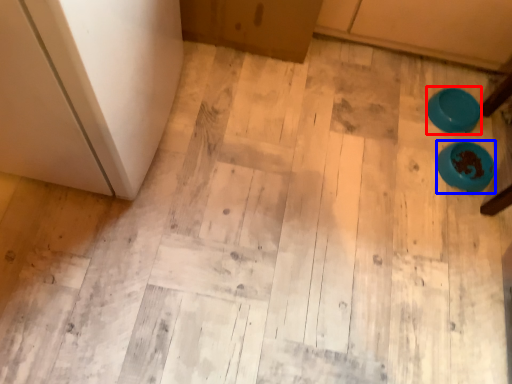
Question: Which object appears farthest to the camera in this image, bowl (highlighted by a red box) or bowl (highlighted by a blue box)?

Choices:
 (A) bowl
 (B) bowl

Answer: (A)